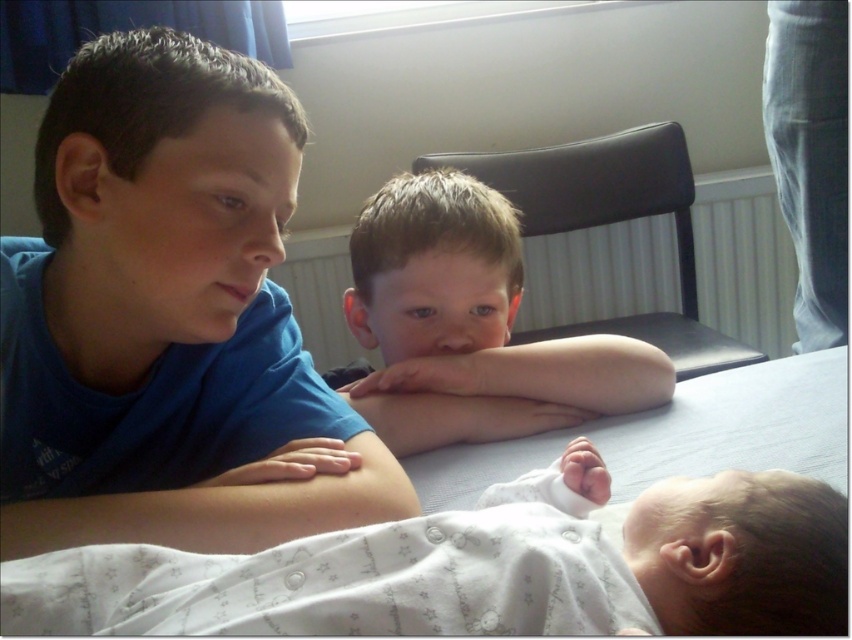
Does blue cotton shirt at upper left have a lesser height compared to white soft fabric baby at lower center?

No.

Consider the image. Is blue cotton shirt at upper left positioned before white soft fabric baby at lower center?

That is False.

The width and height of the screenshot is (852, 640). Identify the location of blue cotton shirt at upper left. (167, 316).

Who is lower down, blue cotton shirt at upper left or light brown skin at center?

light brown skin at center is below.

In the scene shown: Who is more forward, (320, 472) or (410, 378)?

Point (320, 472)

This screenshot has height=640, width=852. Identify the location of blue cotton shirt at upper left. (167, 316).

Is white soft fabric baby at lower center positioned before smooth skin arm at center?

Yes.

Between white soft fabric baby at lower center and smooth skin arm at center, which one has less height?

white soft fabric baby at lower center is shorter.

Which is in front, point (580, 513) or point (620, 376)?

Point (580, 513) is in front.

Locate an element on the screen. white soft fabric baby at lower center is located at coordinates (484, 568).